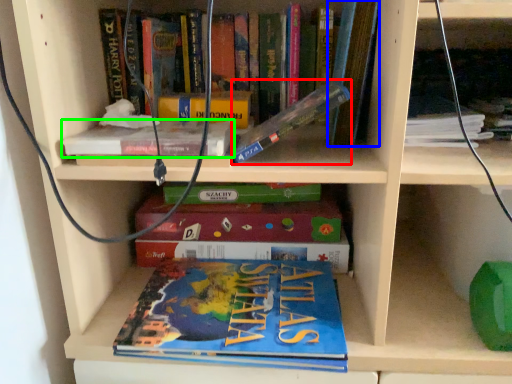
Question: Which is nearer to the book (highlighted by a red box)? book (highlighted by a blue box) or book (highlighted by a green box).

Choices:
 (A) book
 (B) book

Answer: (A)